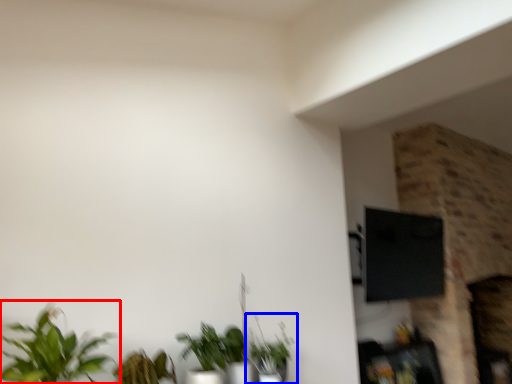
Question: Among these objects, which one is nearest to the camera, houseplant (highlighted by a red box) or houseplant (highlighted by a blue box)?

Choices:
 (A) houseplant
 (B) houseplant

Answer: (A)